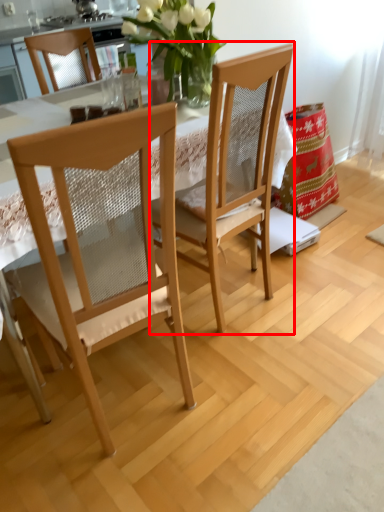
Question: From the image's perspective, what is the correct spatial positioning of chair (annotated by the red box) in reference to chair?

Choices:
 (A) above
 (B) below

Answer: (A)